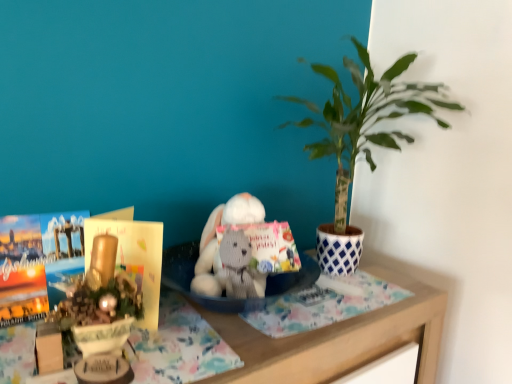
In order to click on vacant space situated on the left part of gray knitted stuffed animal at center in this screenshot , I will do `click(181, 314)`.